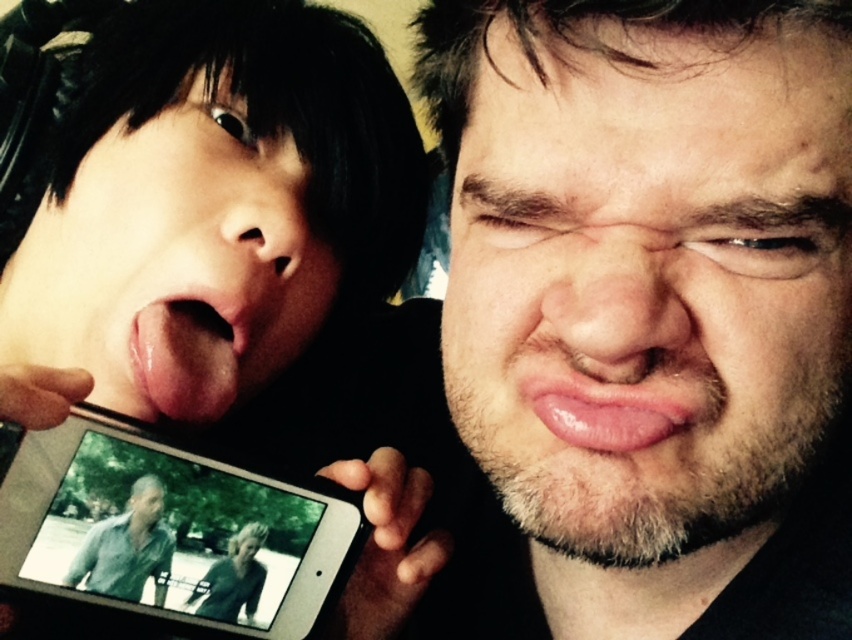
Is point (292, 637) farther from camera compared to point (668, 384)?

Yes, it is behind point (668, 384).

Is point (315, 481) closer to camera compared to point (684, 413)?

That is False.

Is point (113, 604) less distant than point (654, 413)?

That is False.

This screenshot has width=852, height=640. In order to click on silver metallic phone at center in this screenshot , I will do `click(170, 529)`.

Does beige facial hair at center appear on the right side of matte black phone at upper left?

Yes, beige facial hair at center is to the right of matte black phone at upper left.

Is point (766, 212) positioned in front of point (249, 102)?

Yes, it is.

In the scene shown: Who is more distant from viewer, (494, 307) or (135, 67)?

Point (135, 67)

This screenshot has height=640, width=852. Find the location of `beige facial hair at center`. beige facial hair at center is located at coordinates (649, 275).

You are a GUI agent. You are given a task and a screenshot of the screen. Output one action in this format:
    pyautogui.click(x=<x>, y=<y>)
    Task: Click on the matte black phone at upper left
    Image resolution: width=852 pixels, height=640 pixels.
    Given the screenshot: What is the action you would take?
    pyautogui.click(x=239, y=259)

Is point (165, 216) closer to camera compared to point (286, 330)?

Yes, it is in front of point (286, 330).

At what (x,y) coordinates should I click in order to perform the action: click on matte black phone at upper left. Please return your answer as a coordinate pair (x, y). The image size is (852, 640). Looking at the image, I should click on (239, 259).